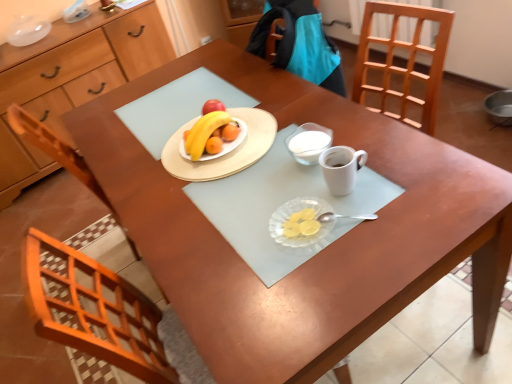
Question: Does white matte coffee cup at center touch yellow matte grapefruit at center?

Choices:
 (A) yes
 (B) no

Answer: (B)

Question: From a real-world perspective, is white matte coffee cup at center located beneath yellow matte grapefruit at center?

Choices:
 (A) yes
 (B) no

Answer: (B)

Question: Considering the relative sizes of white matte coffee cup at center and yellow matte grapefruit at center in the image provided, is white matte coffee cup at center wider than yellow matte grapefruit at center?

Choices:
 (A) no
 (B) yes

Answer: (A)

Question: Considering the relative sizes of white matte coffee cup at center and yellow matte grapefruit at center in the image provided, is white matte coffee cup at center thinner than yellow matte grapefruit at center?

Choices:
 (A) no
 (B) yes

Answer: (B)

Question: Is white matte coffee cup at center not near yellow matte grapefruit at center?

Choices:
 (A) yes
 (B) no

Answer: (B)

Question: From a real-world perspective, is yellow matte grapefruit at center above or below transparent glass plate at center?

Choices:
 (A) above
 (B) below

Answer: (B)

Question: Is point (199, 124) positioned closer to the camera than point (275, 238)?

Choices:
 (A) farther
 (B) closer

Answer: (A)

Question: Considering their positions, is yellow matte grapefruit at center located in front of or behind transparent glass plate at center?

Choices:
 (A) front
 (B) behind

Answer: (B)

Question: Based on their positions, is yellow matte grapefruit at center located to the left or right of transparent glass plate at center?

Choices:
 (A) left
 (B) right

Answer: (A)

Question: Based on their sizes in the image, would you say transparent glass plate at center is bigger or smaller than white matte coffee cup at center?

Choices:
 (A) big
 (B) small

Answer: (B)

Question: Is point (279, 241) closer or farther from the camera than point (360, 157)?

Choices:
 (A) closer
 (B) farther

Answer: (A)

Question: From a real-world perspective, relative to white matte coffee cup at center, is transparent glass plate at center vertically above or below?

Choices:
 (A) above
 (B) below

Answer: (B)

Question: Considering the positions of transparent glass plate at center and white matte coffee cup at center in the image, is transparent glass plate at center taller or shorter than white matte coffee cup at center?

Choices:
 (A) tall
 (B) short

Answer: (B)

Question: Looking at the image, does white glass bowl at center seem bigger or smaller compared to matte wooden plate at center?

Choices:
 (A) big
 (B) small

Answer: (B)

Question: From a real-world perspective, relative to matte wooden plate at center, is white glass bowl at center vertically above or below?

Choices:
 (A) below
 (B) above

Answer: (B)